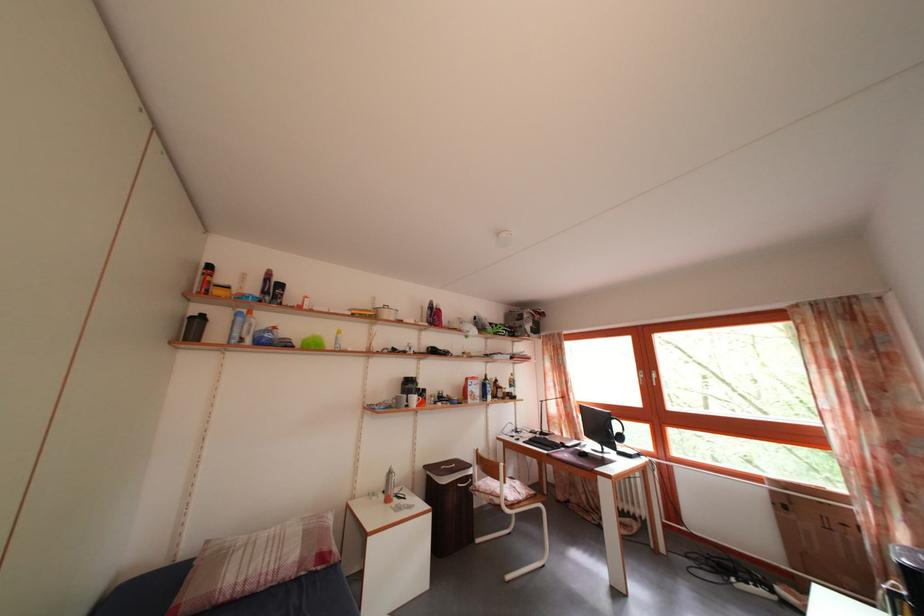
Find the location of a particular element. white mug handle is located at coordinates (411, 400).